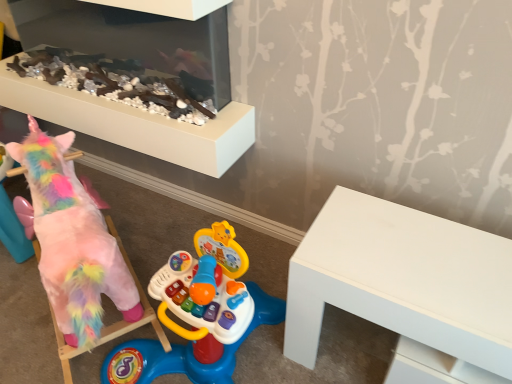
Locate an element on the screen. Image resolution: width=512 pixels, height=384 pixels. free point above white matte table at right (from a real-world perspective) is located at coordinates (423, 255).